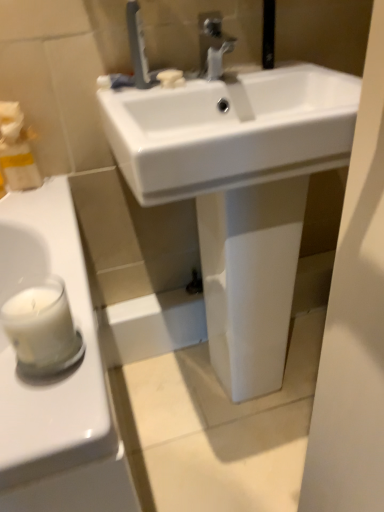
At what (x,y) coordinates should I click in order to perform the action: click on unoccupied region to the right of satin nickel faucet at upper center, the 1th tap positioned from the left. Please return your answer as a coordinate pair (x, y). The height and width of the screenshot is (512, 384). Looking at the image, I should click on (217, 78).